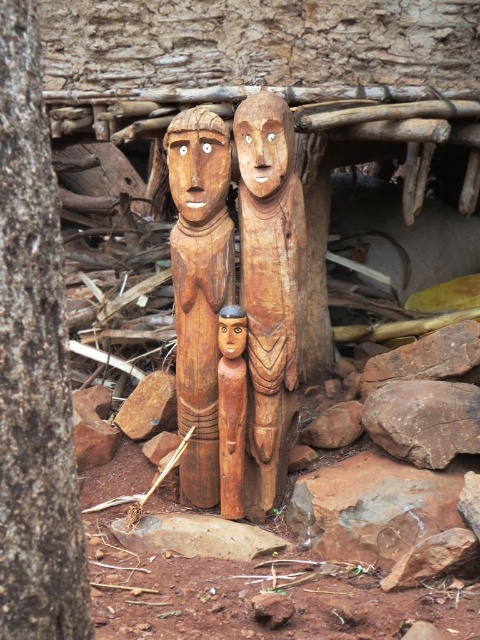
You are an artist planning to place a new sculpture between the brown rough rock at center and the brown rough stone at lower left. To ensure stability, you need to know which base is wider. Can you determine which one is wider?

The brown rough rock at center might be wider than brown rough stone at lower left, so it could provide a wider base for the new sculpture.

You are a sculptor visiting an outdoor art installation. You see the wooden statue at center and the brown rough rock at center. Which object is bigger in size?

The wooden statue at center is larger in size compared to the brown rough rock at center according to the description.